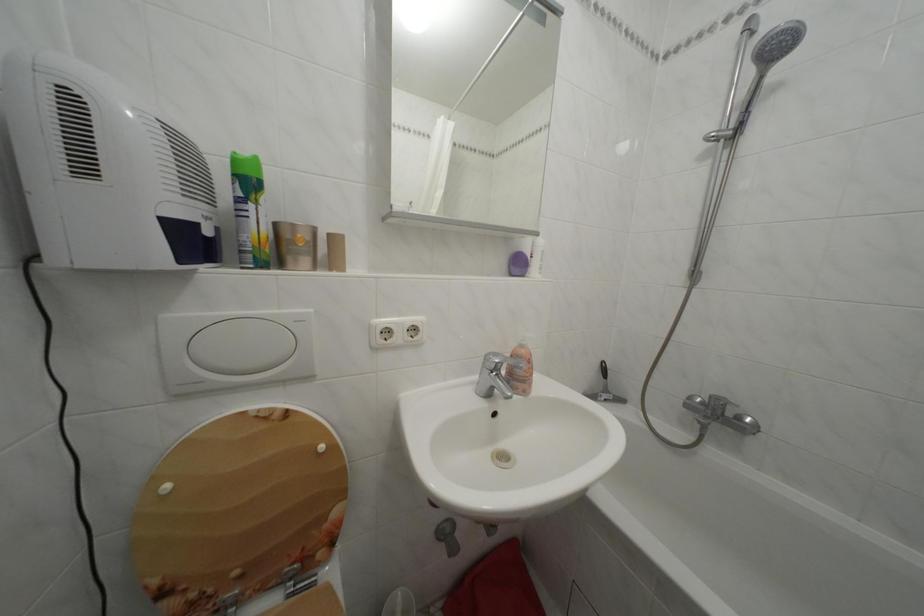
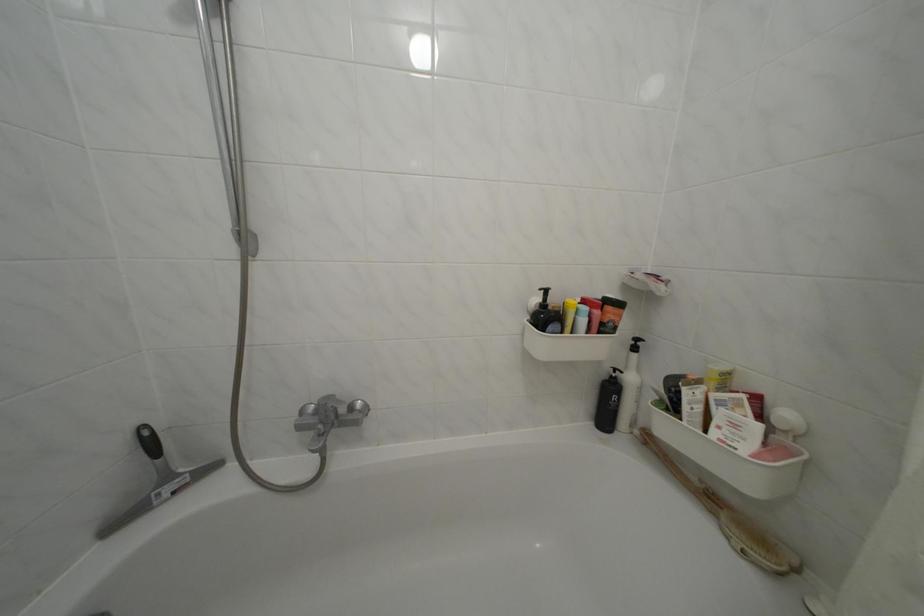
Where in the second image is the point corresponding to pixel 711 413 from the first image?

(323, 426)